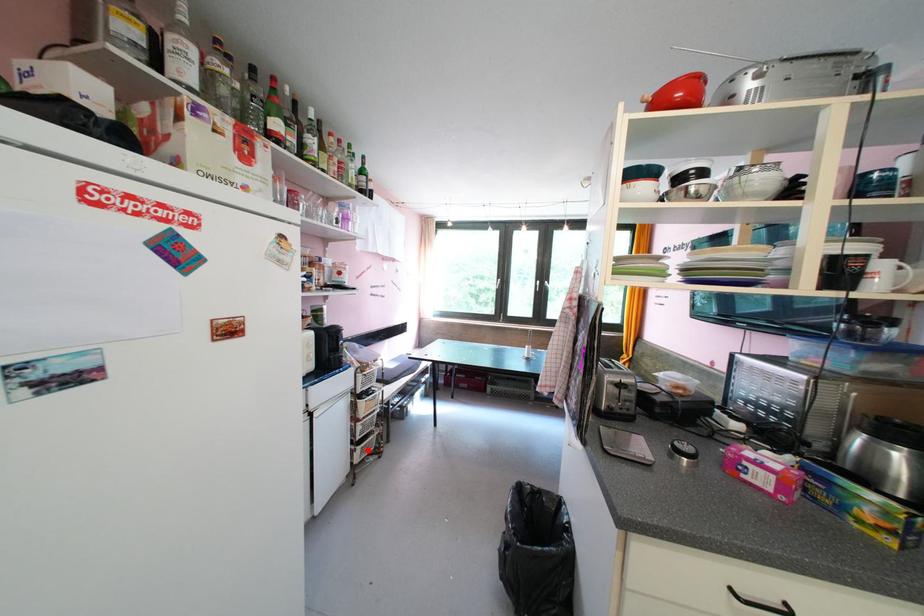
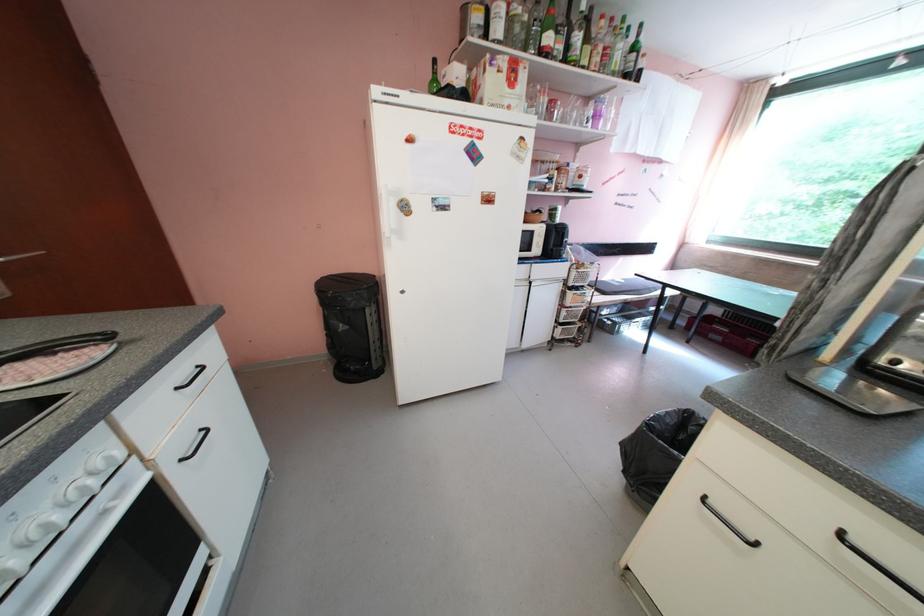
Question: I am providing you with two images of the same scene from different viewpoints. Given a red point in image1, look at the same physical point in image2. Is it:

Choices:
 (A) Closer to the viewpoint
 (B) Farther from the viewpoint

Answer: (B)